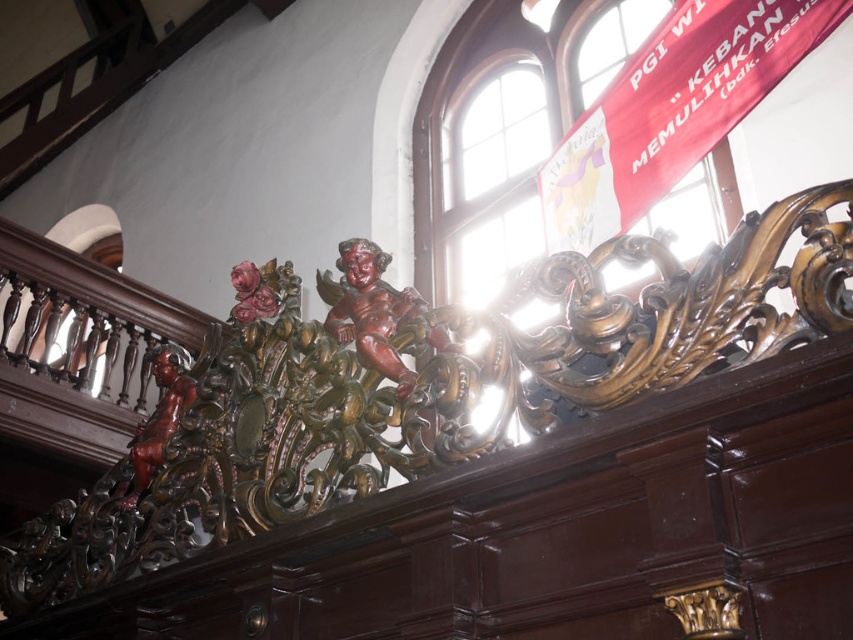
Based on the provided scene description, where exactly is the wooden carving at center located in terms of coordinates?

The wooden carving at center is located at coordinates point (486, 461).